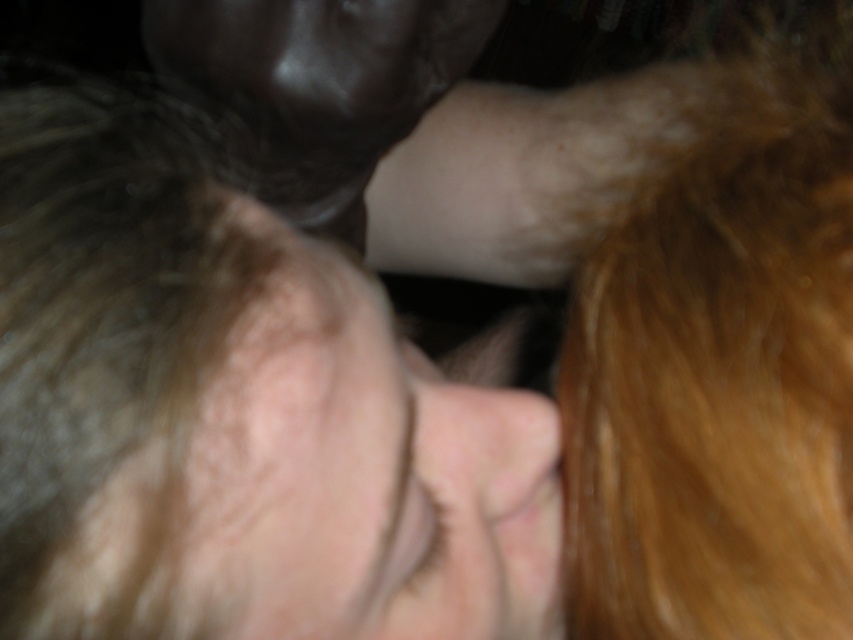
You are a photographer trying to adjust the lighting for a portrait. You notice two areas on the subject, the smooth skin face at center and the pale skin at center. Which area is positioned to the left of the other?

The smooth skin face at center is to the left of the pale skin at center.

You are a photographer trying to adjust the lighting for a portrait. You notice the blonde silky hair at right and the pink flesh at center in the image. Which area requires more light to ensure proper exposure?

The blonde silky hair at right requires more light because it is larger than the pink flesh at center and may appear underexposed in the dim lighting.

Based on the scene description, which object is wider, the pale skin at center or the pink flesh at center?

The pale skin at center is wider than the pink flesh at center according to the description.